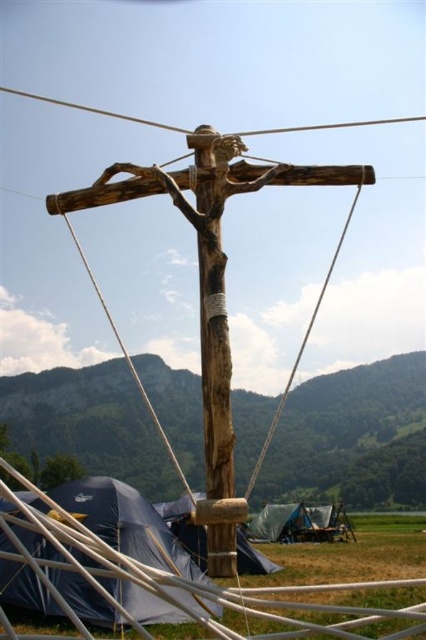
You are a camper who just arrived at the scene and want to set up your tent. You see the natural wood cross at center and the blue fabric tent at center. Which object is located to the right of the other?

The natural wood cross at center is positioned on the right side of blue fabric tent at center.